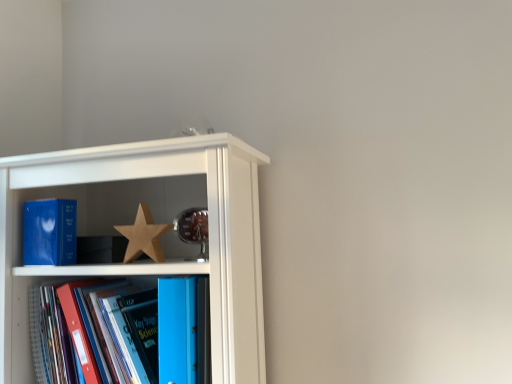
Question: Is wooden star at center not within matte wooden shelf at upper left?

Choices:
 (A) no
 (B) yes

Answer: (A)

Question: Does wooden star at center have a greater height compared to matte wooden shelf at upper left?

Choices:
 (A) no
 (B) yes

Answer: (A)

Question: Can you confirm if wooden star at center is bigger than matte wooden shelf at upper left?

Choices:
 (A) no
 (B) yes

Answer: (A)

Question: Is wooden star at center wider than matte wooden shelf at upper left?

Choices:
 (A) yes
 (B) no

Answer: (B)

Question: From the image's perspective, is wooden star at center located above matte wooden shelf at upper left?

Choices:
 (A) no
 (B) yes

Answer: (B)

Question: Is wooden star at center at the left side of matte wooden shelf at upper left?

Choices:
 (A) yes
 (B) no

Answer: (B)

Question: Considering the relative sizes of blue glossy folder at lower left, marked as the second book in a right-to-left arrangement, and matte wooden shelf at upper left in the image provided, is blue glossy folder at lower left, marked as the second book in a right-to-left arrangement, smaller than matte wooden shelf at upper left?

Choices:
 (A) no
 (B) yes

Answer: (B)

Question: From a real-world perspective, is blue glossy folder at lower left, which is counted as the 2th book, starting from the left, on top of matte wooden shelf at upper left?

Choices:
 (A) yes
 (B) no

Answer: (B)

Question: From a real-world perspective, is blue glossy folder at lower left, which is counted as the 2th book, starting from the left, under matte wooden shelf at upper left?

Choices:
 (A) no
 (B) yes

Answer: (B)

Question: Does blue glossy folder at lower left, which is counted as the 2th book, starting from the left, have a greater width compared to matte wooden shelf at upper left?

Choices:
 (A) no
 (B) yes

Answer: (A)

Question: Is blue glossy folder at lower left, marked as the second book in a right-to-left arrangement, taller than matte wooden shelf at upper left?

Choices:
 (A) no
 (B) yes

Answer: (A)

Question: Does blue glossy folder at lower left, which is counted as the 2th book, starting from the left, lie behind matte wooden shelf at upper left?

Choices:
 (A) yes
 (B) no

Answer: (A)

Question: Is blue matte book at left, which ranks as the first book in left-to-right order, facing away from blue plastic folder at center, placed as the 3th book when sorted from left to right?

Choices:
 (A) no
 (B) yes

Answer: (A)